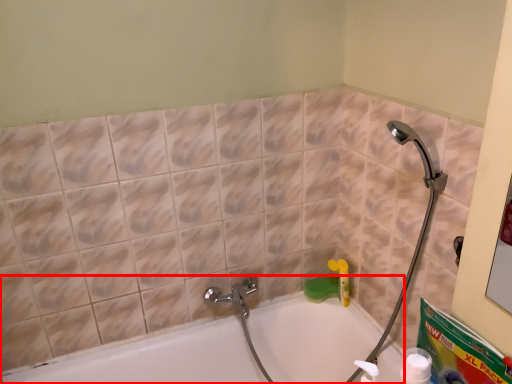
Question: Considering the relative positions of bathtub (annotated by the red box) and cleaning product in the image provided, where is bathtub (annotated by the red box) located with respect to the staircase?

Choices:
 (A) right
 (B) left

Answer: (B)